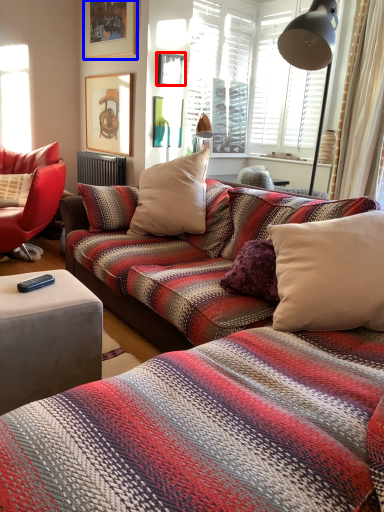
Question: Among these objects, which one is nearest to the camera, picture frame (highlighted by a red box) or picture frame (highlighted by a blue box)?

Choices:
 (A) picture frame
 (B) picture frame

Answer: (B)